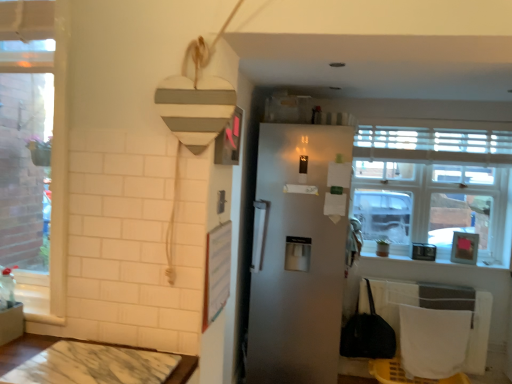
Question: Does marble table at lower left have a lesser height compared to clear glass window at upper right?

Choices:
 (A) yes
 (B) no

Answer: (A)

Question: Does marble table at lower left touch clear glass window at upper right?

Choices:
 (A) no
 (B) yes

Answer: (A)

Question: Would you say clear glass window at upper right is part of marble table at lower left's contents?

Choices:
 (A) no
 (B) yes

Answer: (A)

Question: Is marble table at lower left completely or partially outside of clear glass window at upper right?

Choices:
 (A) yes
 (B) no

Answer: (A)

Question: From the image's perspective, is marble table at lower left over clear glass window at upper right?

Choices:
 (A) yes
 (B) no

Answer: (B)

Question: Considering the relative sizes of marble table at lower left and clear glass window at upper right in the image provided, is marble table at lower left thinner than clear glass window at upper right?

Choices:
 (A) yes
 (B) no

Answer: (B)

Question: Is satin white fridge at center wider than clear glass window at upper right?

Choices:
 (A) no
 (B) yes

Answer: (B)

Question: Can you confirm if satin white fridge at center is bigger than clear glass window at upper right?

Choices:
 (A) no
 (B) yes

Answer: (B)

Question: Does satin white fridge at center have a smaller size compared to clear glass window at upper right?

Choices:
 (A) yes
 (B) no

Answer: (B)

Question: From the image's perspective, is satin white fridge at center on top of clear glass window at upper right?

Choices:
 (A) yes
 (B) no

Answer: (B)

Question: Is clear glass window at upper right a part of satin white fridge at center?

Choices:
 (A) yes
 (B) no

Answer: (B)

Question: Is satin white fridge at center shorter than clear glass window at upper right?

Choices:
 (A) yes
 (B) no

Answer: (B)

Question: Is clear glass window at upper right thinner than marble table at lower left?

Choices:
 (A) no
 (B) yes

Answer: (B)